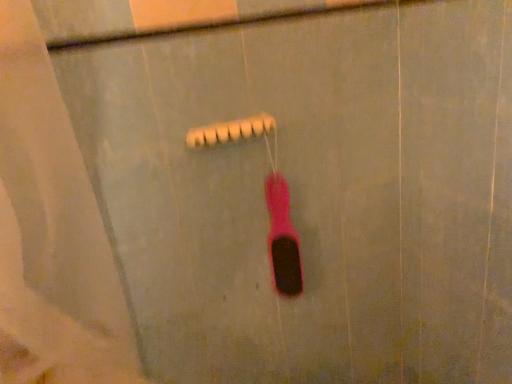
Question: Does pink rubber toothbrush at center have a lesser height compared to beige matte shower head at center?

Choices:
 (A) yes
 (B) no

Answer: (B)

Question: Is pink rubber toothbrush at center aimed at beige matte shower head at center?

Choices:
 (A) yes
 (B) no

Answer: (B)

Question: Is pink rubber toothbrush at center further to the viewer compared to beige matte shower head at center?

Choices:
 (A) no
 (B) yes

Answer: (B)

Question: From the image's perspective, does pink rubber toothbrush at center appear lower than beige matte shower head at center?

Choices:
 (A) yes
 (B) no

Answer: (A)

Question: Is the position of pink rubber toothbrush at center less distant than that of beige matte shower head at center?

Choices:
 (A) yes
 (B) no

Answer: (B)

Question: From a real-world perspective, is pink rubber toothbrush at center on top of beige matte shower head at center?

Choices:
 (A) yes
 (B) no

Answer: (B)

Question: Does beige matte shower head at center have a lesser width compared to pink rubber toothbrush at center?

Choices:
 (A) yes
 (B) no

Answer: (B)

Question: Is beige matte shower head at center located outside pink rubber toothbrush at center?

Choices:
 (A) yes
 (B) no

Answer: (A)

Question: Can you confirm if beige matte shower head at center is bigger than pink rubber toothbrush at center?

Choices:
 (A) no
 (B) yes

Answer: (A)

Question: Considering the relative sizes of beige matte shower head at center and pink rubber toothbrush at center in the image provided, is beige matte shower head at center taller than pink rubber toothbrush at center?

Choices:
 (A) no
 (B) yes

Answer: (A)

Question: Does beige matte shower head at center have a greater width compared to pink rubber toothbrush at center?

Choices:
 (A) yes
 (B) no

Answer: (A)

Question: From the image's perspective, would you say beige matte shower head at center is shown under pink rubber toothbrush at center?

Choices:
 (A) yes
 (B) no

Answer: (B)

Question: From a real-world perspective, relative to beige matte shower head at center, is pink rubber toothbrush at center vertically above or below?

Choices:
 (A) above
 (B) below

Answer: (B)